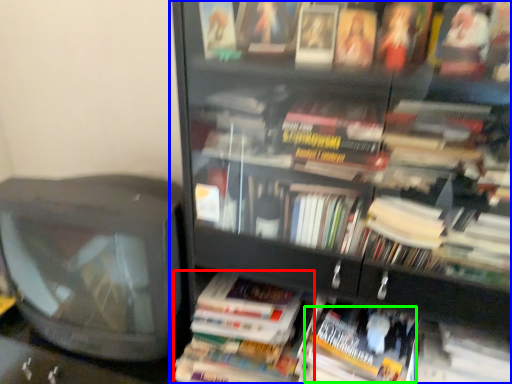
Question: Which object is the closest to the paperback book (highlighted by a red box)? Choose among these: bookcase (highlighted by a blue box) or paperback book (highlighted by a green box).

Choices:
 (A) bookcase
 (B) paperback book

Answer: (B)